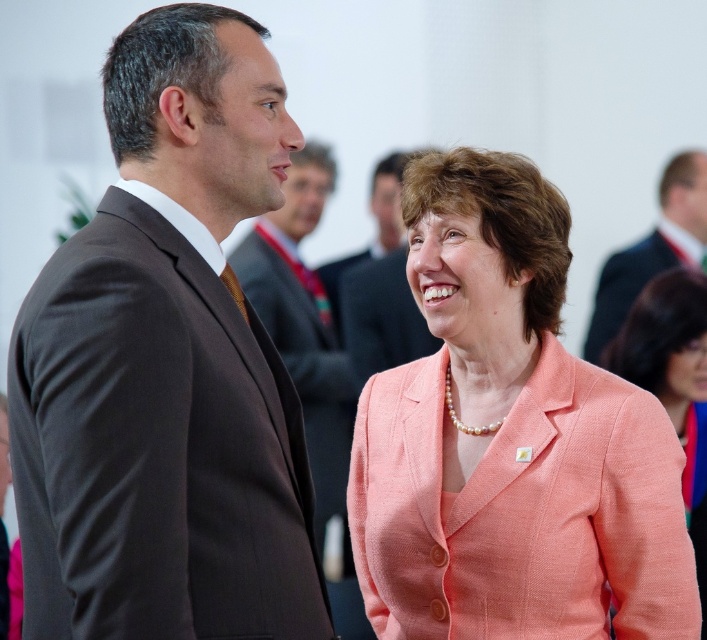
Question: In this image, where is dark brown suit at left located relative to pearl necklace at upper center?

Choices:
 (A) below
 (B) above

Answer: (A)

Question: Is peach fabric jacket at center bigger than pearl necklace at upper center?

Choices:
 (A) yes
 (B) no

Answer: (A)

Question: Estimate the real-world distances between objects in this image. Which object is closer to the brown suit at center?

Choices:
 (A) dark brown suit at left
 (B) peach textured blazer at center

Answer: (B)

Question: Does brown suit at center appear on the right side of dark brown suit at center?

Choices:
 (A) yes
 (B) no

Answer: (B)

Question: Which point is farther from the camera taking this photo?

Choices:
 (A) (696, 268)
 (B) (274, 253)
 (C) (373, 285)

Answer: (A)

Question: Which object is closer to the camera taking this photo?

Choices:
 (A) peach fabric jacket at center
 (B) pearl necklace at upper center

Answer: (A)